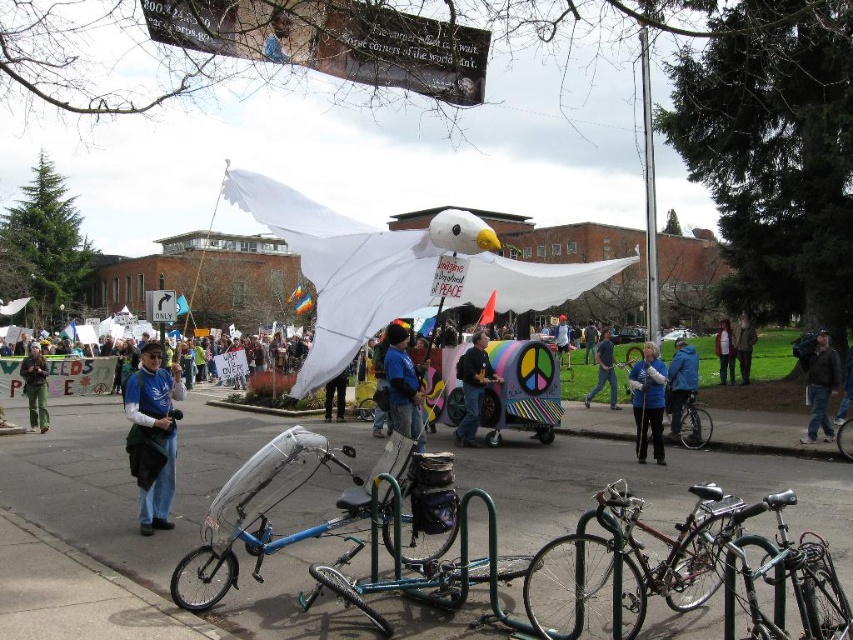
Who is more distant from viewer, [698,563] or [720,342]?

The point [720,342] is more distant.

What are the coordinates of `silver metallic bicycle at lower right` in the screenshot? It's located at (624, 566).

Is point (698, 504) behind point (722, 381)?

No, it is in front of (722, 381).

Locate an element on the screen. This screenshot has width=853, height=640. silver metallic bicycle at lower right is located at coordinates (624, 566).

Can you confirm if shiny black bicycle at lower right is taller than blue fabric jacket at center?

Incorrect, shiny black bicycle at lower right's height is not larger of blue fabric jacket at center's.

At what (x,y) coordinates should I click in order to perform the action: click on shiny black bicycle at lower right. Please return your answer as a coordinate pair (x, y). This screenshot has width=853, height=640. Looking at the image, I should click on (782, 579).

Locate an element on the screen. The height and width of the screenshot is (640, 853). shiny black bicycle at lower right is located at coordinates (782, 579).

Between point (709, 566) and point (612, 349), which one is positioned behind?

Point (612, 349)

Does silver metallic bicycle at lower right have a larger size compared to blue fabric at center?

Actually, silver metallic bicycle at lower right might be smaller than blue fabric at center.

Between point (618, 550) and point (608, 384), which one is positioned behind?

The point (608, 384) is behind.

Where is `silver metallic bicycle at lower right`? silver metallic bicycle at lower right is located at coordinates (624, 566).